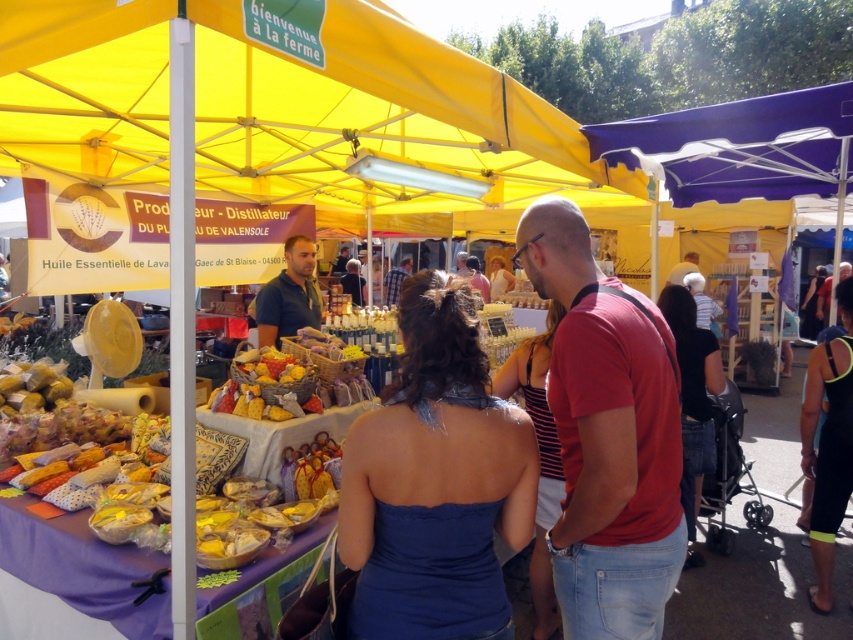
Does matte blue shirt at center come behind matte pink shirt at center?

No, matte blue shirt at center is in front of matte pink shirt at center.

Which is more to the right, matte blue shirt at center or matte pink shirt at center?

From the viewer's perspective, matte pink shirt at center appears more on the right side.

This screenshot has width=853, height=640. Identify the location of matte blue shirt at center. [x=289, y=294].

Can you confirm if red cotton t-shirt at center is shorter than bright yellow fabric at center?

No, red cotton t-shirt at center is not shorter than bright yellow fabric at center.

Is point (660, 442) farther from camera compared to point (264, 388)?

No.

Is point (675, 536) less distant than point (245, 387)?

Yes, it is.

Find the location of a particular element. This screenshot has height=640, width=853. red cotton t-shirt at center is located at coordinates (607, 435).

Is point (701, 337) farther from camera compared to point (489, 296)?

No, it is in front of (489, 296).

Is black denim jeans at lower right closer to camera compared to matte pink shirt at center?

Yes.

Is point (685, 330) positioned after point (485, 282)?

No, (685, 330) is in front of (485, 282).

The height and width of the screenshot is (640, 853). Find the location of `black denim jeans at lower right`. black denim jeans at lower right is located at coordinates (693, 394).